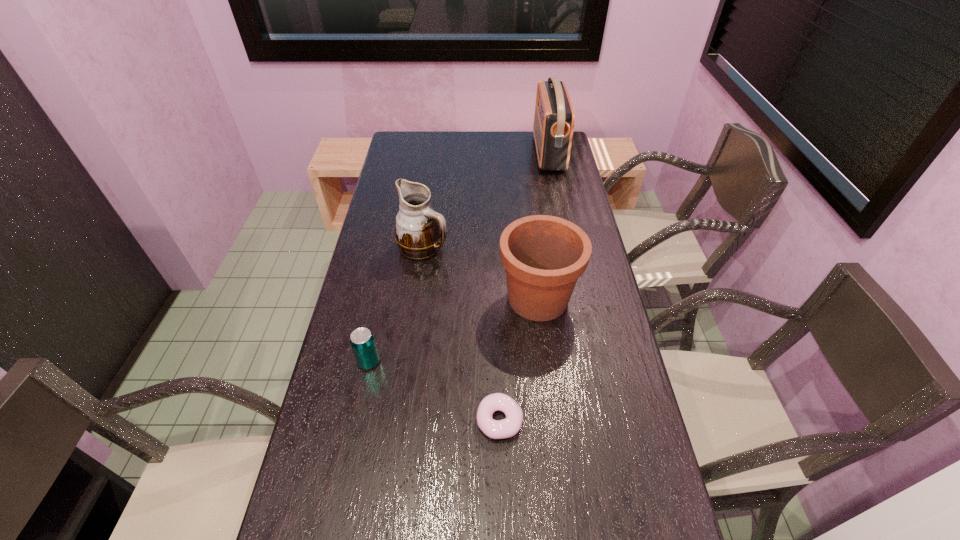
Find the location of a particular element. This screenshot has width=960, height=540. free area in between the flowerpot and the second nearest object is located at coordinates 453,330.

This screenshot has height=540, width=960. In order to click on free space between the third farthest object and the doughnut in this screenshot , I will do `click(518, 359)`.

Locate an element on the screen. vacant space in between the radio receiver and the second farthest object is located at coordinates (486, 200).

The image size is (960, 540). What are the coordinates of `free space between the beer can and the radio receiver` in the screenshot? It's located at click(459, 258).

You are a GUI agent. You are given a task and a screenshot of the screen. Output one action in this format:
    pyautogui.click(x=<x>, y=<y>)
    Task: Click on the third closest object to the beer can
    
    Given the screenshot: What is the action you would take?
    pyautogui.click(x=420, y=232)

Select which object appears as the closest to the second nearest object. Please provide its 2D coordinates. Your answer should be formatted as a tuple, i.e. [(x, y)], where the tuple contains the x and y coordinates of a point satisfying the conditions above.

[(506, 428)]

This screenshot has height=540, width=960. Identify the location of free region that satisfies the following two spatial constraints: 1. from the spout of the flowerpot; 2. on the left side of the pitcher. (417, 299).

Locate an element on the screen. This screenshot has width=960, height=540. vacant space that satisfies the following two spatial constraints: 1. on the back side of the fourth tallest object; 2. on the right side of the third farthest object is located at coordinates (382, 299).

Find the location of a particular element. free location that satisfies the following two spatial constraints: 1. from the spout of the second farthest object; 2. on the left side of the nearest object is located at coordinates (400, 420).